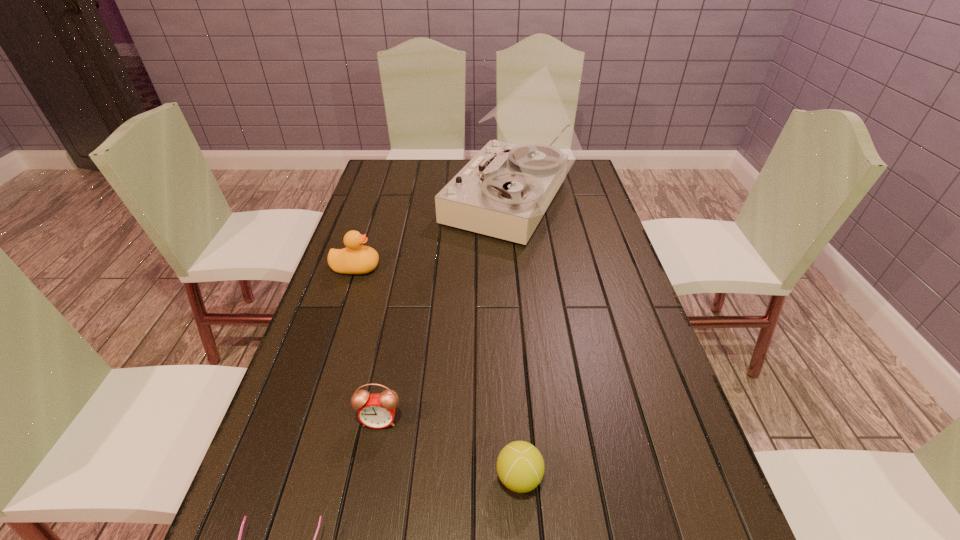
The width and height of the screenshot is (960, 540). What are the coordinates of `record player` in the screenshot? It's located at (505, 189).

The height and width of the screenshot is (540, 960). Identify the location of the farthest object. (505, 189).

This screenshot has height=540, width=960. In order to click on the fourth nearest object in this screenshot , I will do `click(356, 258)`.

This screenshot has height=540, width=960. I want to click on the third farthest object, so click(377, 410).

At what (x,y) coordinates should I click in order to perform the action: click on alarm clock. Please return your answer as a coordinate pair (x, y). Looking at the image, I should click on (377, 410).

Image resolution: width=960 pixels, height=540 pixels. What are the coordinates of `tennis ball` in the screenshot? It's located at click(520, 466).

What are the coordinates of `the fourth farthest object` in the screenshot? It's located at (520, 466).

Image resolution: width=960 pixels, height=540 pixels. What are the coordinates of `vacant point located on the left of the tallest object` in the screenshot? It's located at (415, 203).

Where is `free region located 0.190m on the face of the duck`? free region located 0.190m on the face of the duck is located at coordinates (444, 267).

Locate an element on the screen. This screenshot has width=960, height=540. free space located on the clock face of the third nearest object is located at coordinates (366, 494).